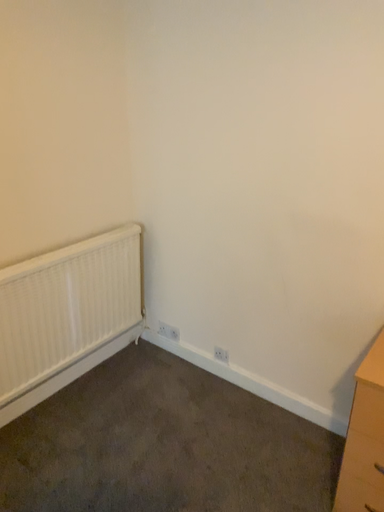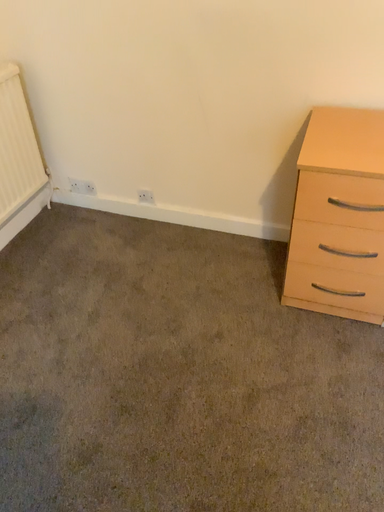
Question: Which way did the camera rotate in the video?

Choices:
 (A) rotated downward
 (B) rotated upward

Answer: (A)